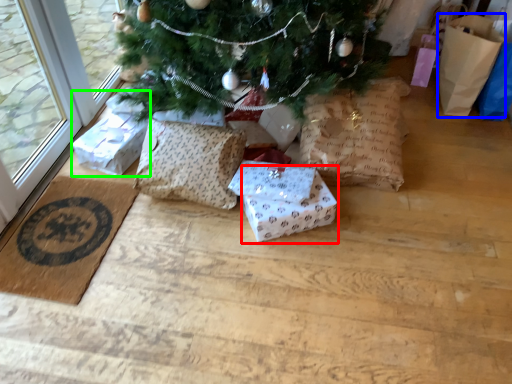
Question: Which object is the closest to the gift box (highlighted by a red box)? Choose among these: gift bag (highlighted by a blue box) or gift box (highlighted by a green box).

Choices:
 (A) gift bag
 (B) gift box

Answer: (B)